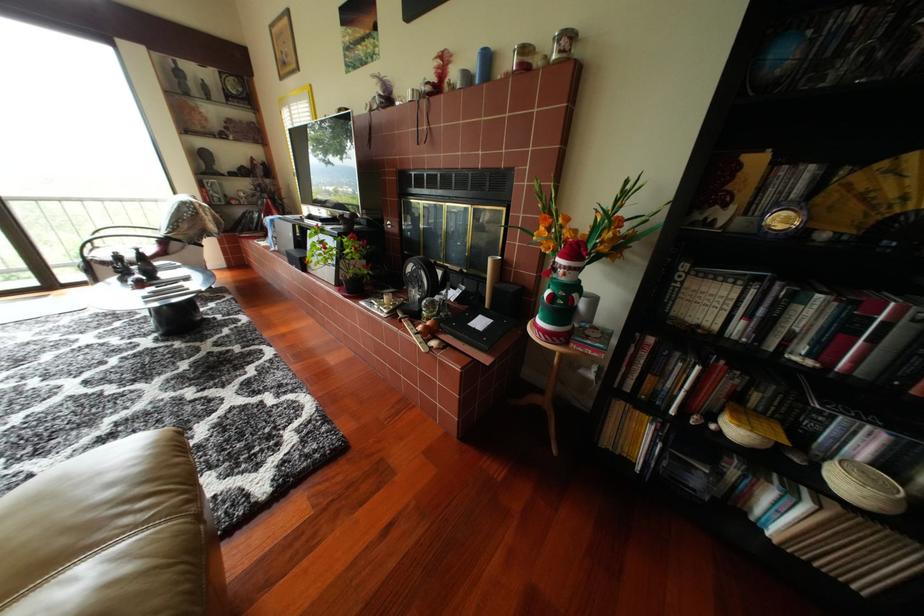
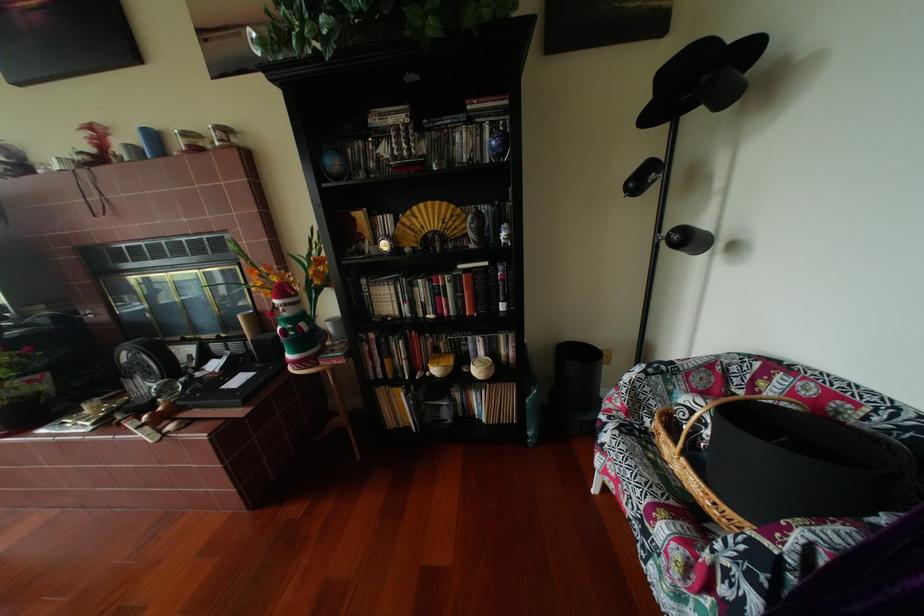
In the second image, find the point that corresponds to [574,272] in the first image.

(294, 310)